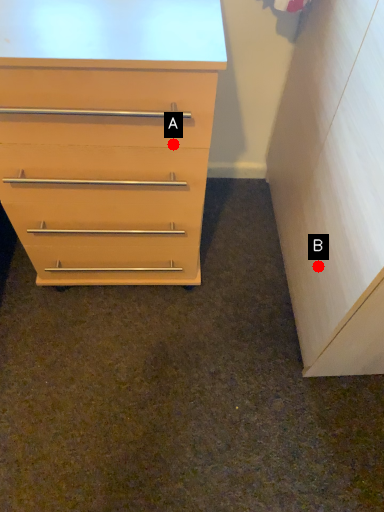
Question: Two points are circled on the image, labeled by A and B beside each circle. Which point is closer to the camera?

Choices:
 (A) A is closer
 (B) B is closer

Answer: (A)